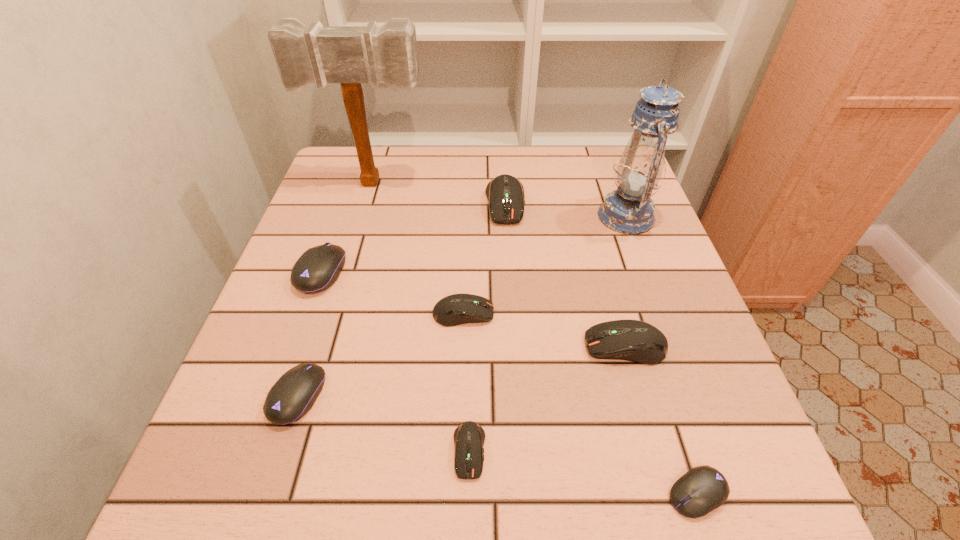
The image size is (960, 540). Identify the location of object that is at the far left corner. (350, 55).

This screenshot has height=540, width=960. I want to click on object that is at the near right corner, so click(x=702, y=489).

This screenshot has height=540, width=960. Find the location of `blank space at the far edge`. blank space at the far edge is located at coordinates (424, 182).

The width and height of the screenshot is (960, 540). In the image, there is a desktop. What are the coordinates of `vacant space at the near edge` in the screenshot? It's located at coord(608,484).

Identify the location of vacant region at the left edge of the desktop. (261, 414).

Where is `free space at the right edge`? This screenshot has height=540, width=960. free space at the right edge is located at coordinates (657, 227).

In the image, there is a desktop. At what (x,y) coordinates should I click in order to perform the action: click on free space at the far left corner. Please return your answer as a coordinate pair (x, y). This screenshot has height=540, width=960. Looking at the image, I should click on (345, 170).

Image resolution: width=960 pixels, height=540 pixels. Find the location of `blank space at the near left corner`. blank space at the near left corner is located at coordinates (226, 509).

You are a GUI agent. You are given a task and a screenshot of the screen. Output one action in this format:
    pyautogui.click(x=<x>, y=<y>)
    Task: Click on the free space at the near right corner of the desktop
    
    Given the screenshot: What is the action you would take?
    pyautogui.click(x=773, y=498)

What are the coordinates of `vacant area that lies between the second farthest computer mouse and the smallest dark computer equipment` in the screenshot? It's located at (396, 361).